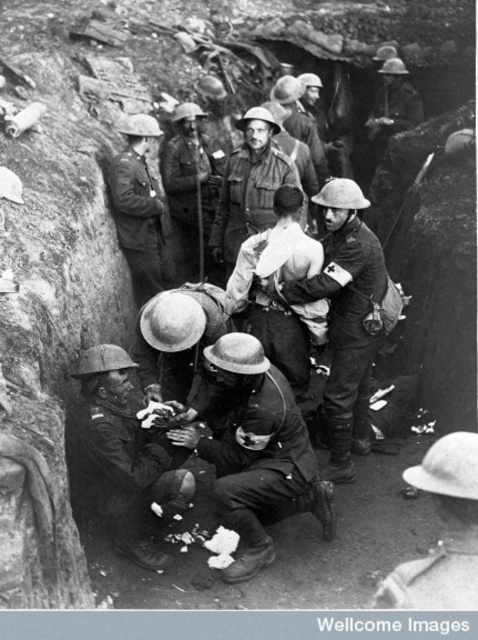
Question: Where is white matte helmet at lower right located in relation to matte khaki uniform at center in the image?

Choices:
 (A) right
 (B) left

Answer: (A)

Question: Which point is farther from the camera taking this photo?

Choices:
 (A) (119, 358)
 (B) (259, 134)

Answer: (B)

Question: Which object is positioned farthest from the smooth leather helmet at center?

Choices:
 (A) matte black helmet at lower left
 (B) matte uniform at center

Answer: (A)

Question: From the image, what is the correct spatial relationship of white matte helmet at lower right in relation to matte uniform at center?

Choices:
 (A) right
 (B) left

Answer: (A)

Question: Is matte black helmet at lower left wider than matte khaki helmet at upper right?

Choices:
 (A) yes
 (B) no

Answer: (B)

Question: Which object is closer to the camera taking this photo?

Choices:
 (A) light brown leather jacket at center
 (B) matte khaki helmet at upper right

Answer: (A)